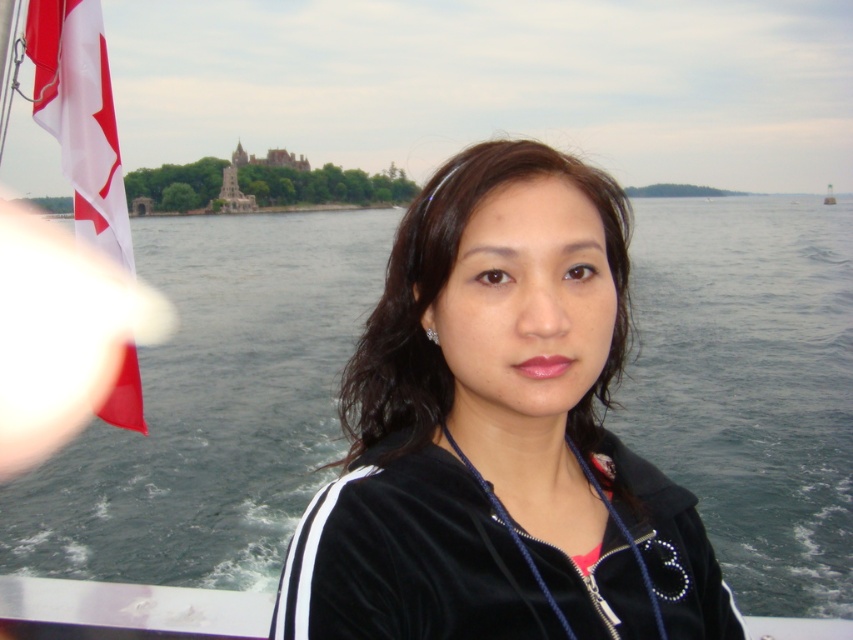
You are a photographer on the boat and want to capture both the black velvety jacket at center and the red fabric flag at left in the same frame. Based on their positions, which object should you focus on first to ensure both are in focus?

The black velvety jacket at center is located below the red fabric flag at left. To capture both in focus, you should focus on the black velvety jacket at center first since it is closer to the camera, ensuring the red fabric flag at left will also be in focus due to its position above.

You are a photographer trying to capture the Canadian flag and the stone structure in the distance. You notice two points marked on your camera screen at coordinates point (645,566) and point (90,140). Which point should you focus on to ensure both the Canadian flag and the stone structure are in focus?

You should focus on point (645,566) because it is closer to the camera than point (90,140), allowing both the Canadian flag and the distant stone structure to be in focus.

You are standing on the boat and want to take a photo of the black velvety jacket at center. The camera you have can focus on objects up to 30 meters away. Will the jacket be in focus?

The black velvety jacket at center is 27.17 meters away from the camera. Since the camera can focus up to 30 meters, the jacket will be in focus.